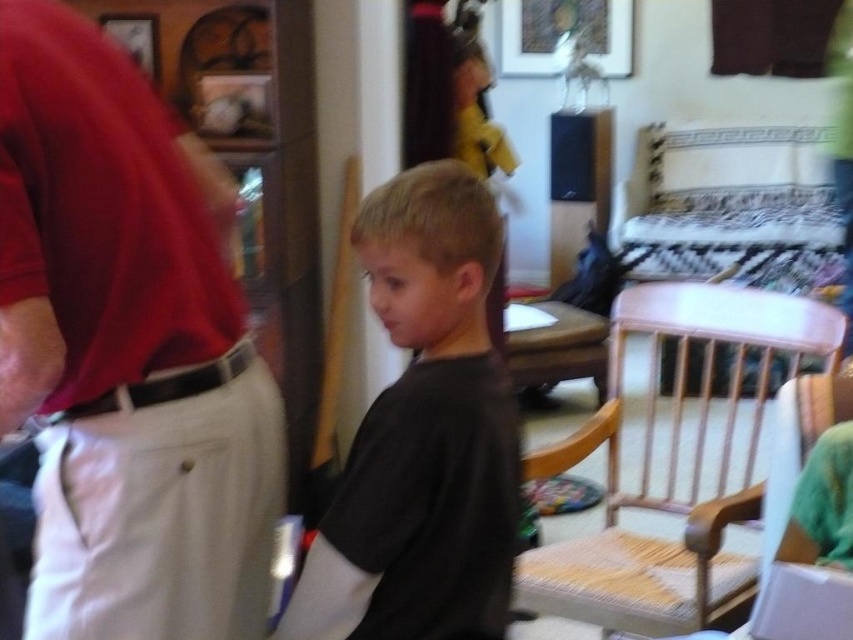
Question: Is matte red shirt at left below white woven wood chair at right?

Choices:
 (A) no
 (B) yes

Answer: (A)

Question: Does matte red shirt at left appear on the right side of black matte shirt at center?

Choices:
 (A) yes
 (B) no

Answer: (B)

Question: Is matte red shirt at left bigger than black matte shirt at center?

Choices:
 (A) yes
 (B) no

Answer: (A)

Question: Which of the following is the closest to the observer?

Choices:
 (A) matte red shirt at left
 (B) white woven wood chair at right
 (C) black matte shirt at center

Answer: (A)

Question: Among these objects, which one is farthest from the camera?

Choices:
 (A) black matte shirt at center
 (B) matte red shirt at left
 (C) white woven wood chair at right

Answer: (C)

Question: Which of the following is the closest to the observer?

Choices:
 (A) white woven wood chair at right
 (B) matte red shirt at left

Answer: (B)